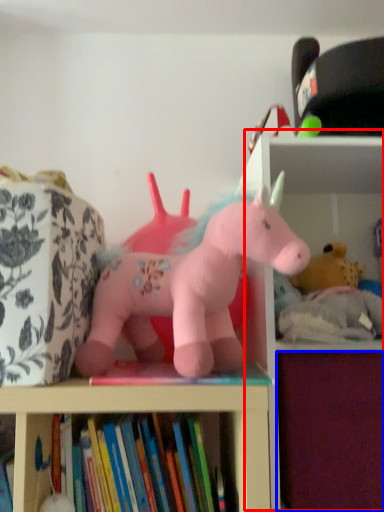
Question: Which of the following is the closest to the observer, bookshelf (highlighted by a red box) or drawer (highlighted by a blue box)?

Choices:
 (A) bookshelf
 (B) drawer

Answer: (A)